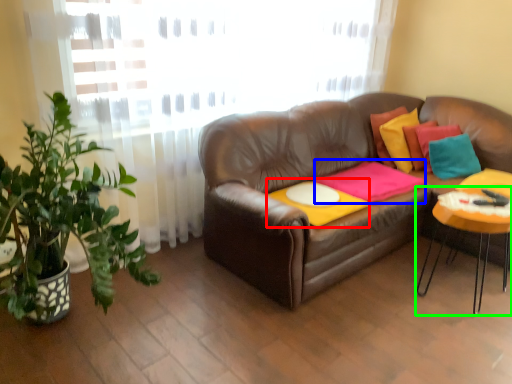
Question: Which object is the closest to the round table (highlighted by a red box)? Choose among these: blanket (highlighted by a blue box) or table (highlighted by a green box).

Choices:
 (A) blanket
 (B) table

Answer: (A)